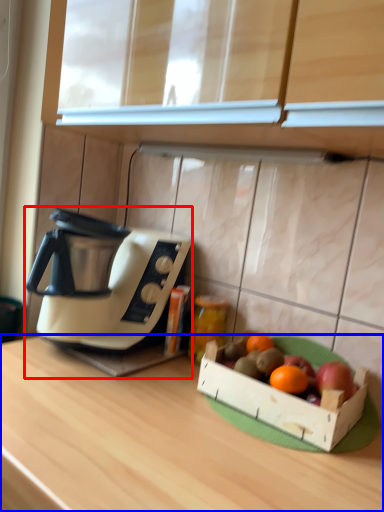
Question: Which of the following is the farthest to the observer, coffee maker (highlighted by a red box) or desk (highlighted by a blue box)?

Choices:
 (A) coffee maker
 (B) desk

Answer: (A)